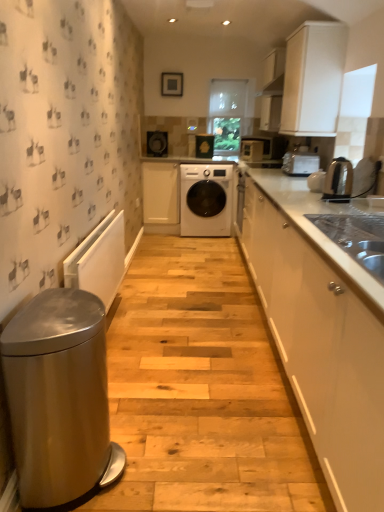
Question: Is matte black microwave at upper right positioned behind white matte cabinet at center, which ranks as the third cabinetry in front-to-back order?

Choices:
 (A) no
 (B) yes

Answer: (B)

Question: Does matte black microwave at upper right contain white matte cabinet at center, arranged as the first cabinetry when viewed from the left?

Choices:
 (A) no
 (B) yes

Answer: (A)

Question: Is there a large distance between matte black microwave at upper right and white matte cabinet at center, arranged as the first cabinetry when viewed from the left?

Choices:
 (A) yes
 (B) no

Answer: (A)

Question: Is matte black microwave at upper right taller than white matte cabinet at center, which ranks as the third cabinetry in front-to-back order?

Choices:
 (A) no
 (B) yes

Answer: (A)

Question: From a real-world perspective, is matte black microwave at upper right positioned over white matte cabinet at center, which ranks as the third cabinetry in front-to-back order, based on gravity?

Choices:
 (A) yes
 (B) no

Answer: (A)

Question: Is the depth of matte black microwave at upper right less than that of white matte cabinet at center, the 1th cabinetry viewed from the back?

Choices:
 (A) yes
 (B) no

Answer: (B)

Question: From a real-world perspective, is matte black speaker at upper center, the third appliance from the bottom, positioned under satin silver toaster at upper right, which is the 2th home appliance in bottom-to-top order, based on gravity?

Choices:
 (A) no
 (B) yes

Answer: (A)

Question: Does matte black speaker at upper center, the third appliance from the bottom, have a lesser height compared to satin silver toaster at upper right, the second home appliance positioned from the front?

Choices:
 (A) no
 (B) yes

Answer: (A)

Question: Considering the relative positions of matte black speaker at upper center, positioned as the second appliance in top-to-bottom order, and satin silver toaster at upper right, which is the 2th home appliance in bottom-to-top order, in the image provided, is matte black speaker at upper center, positioned as the second appliance in top-to-bottom order, to the right of satin silver toaster at upper right, which is the 2th home appliance in bottom-to-top order, from the viewer's perspective?

Choices:
 (A) no
 (B) yes

Answer: (A)

Question: Considering the relative positions of matte black speaker at upper center, the 2th appliance in the back-to-front sequence, and satin silver toaster at upper right, which is the 2th home appliance in bottom-to-top order, in the image provided, is matte black speaker at upper center, the 2th appliance in the back-to-front sequence, to the left of satin silver toaster at upper right, which is the 2th home appliance in bottom-to-top order, from the viewer's perspective?

Choices:
 (A) no
 (B) yes

Answer: (B)

Question: From a real-world perspective, is matte black speaker at upper center, the third appliance from the bottom, on top of satin silver toaster at upper right, placed as the first home appliance when sorted from top to bottom?

Choices:
 (A) no
 (B) yes

Answer: (B)

Question: Is matte black speaker at upper center, positioned as the second appliance in top-to-bottom order, next to satin silver toaster at upper right, the 1th home appliance from the back, and touching it?

Choices:
 (A) no
 (B) yes

Answer: (A)

Question: Can you confirm if metallic silver kettle at right, positioned as the 1th home appliance in front-to-back order, is thinner than white glossy cabinet at right, acting as the second cabinetry starting from the left?

Choices:
 (A) yes
 (B) no

Answer: (A)